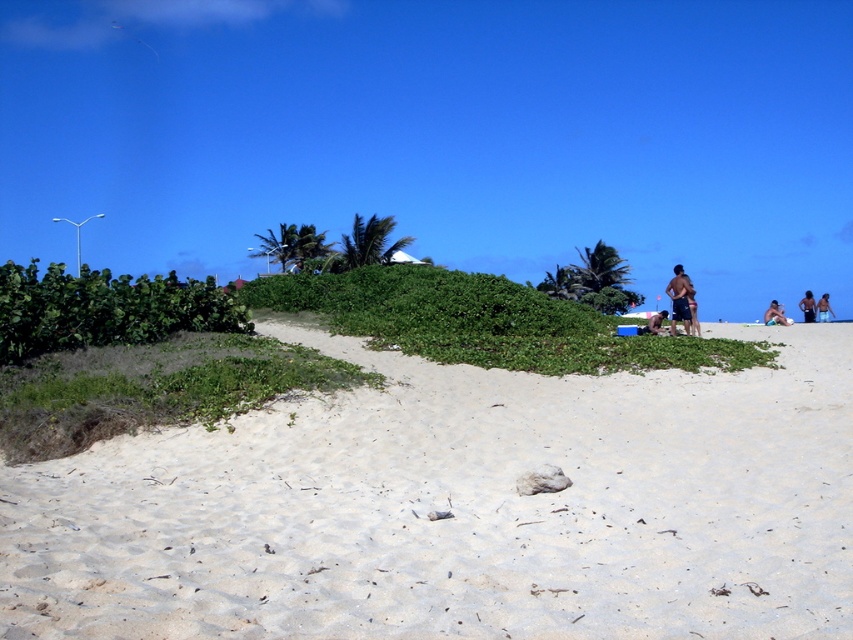
You are a photographer standing on the beach and want to capture both the green leafy bush at center and the brown skin at upper right in a single shot. Which object will appear smaller in the photo?

The green leafy bush at center will appear smaller in the photo because it is shorter than the brown skin at upper right.

You are a hiker who wants to place a small backpack on the green leafy bush at center and the brown skin at upper right. Which object can the backpack fit on better?

The brown skin at upper right can hold the backpack better because it has a larger size compared to the green leafy bush at center.